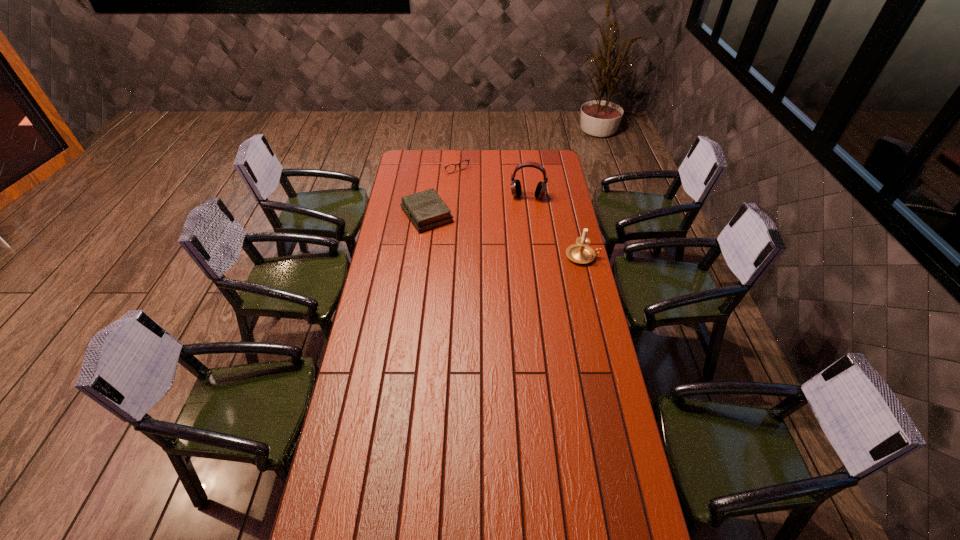
At what (x,y) coordinates should I click in order to perform the action: click on vacant space at the left edge of the desktop. Please return your answer as a coordinate pair (x, y). This screenshot has width=960, height=540. Looking at the image, I should click on click(420, 180).

At what (x,y) coordinates should I click in order to perform the action: click on free space at the right edge of the desktop. Please return your answer as a coordinate pair (x, y). The image size is (960, 540). Looking at the image, I should click on (552, 239).

Locate an element on the screen. vacant space at the far right corner of the desktop is located at coordinates (546, 150).

The width and height of the screenshot is (960, 540). I want to click on free spot between the farthest object and the candle holder, so pos(516,210).

Identify the location of unoccupied area between the candle holder and the farthest object. The image size is (960, 540). (516, 210).

Identify the location of blank region between the book and the shortest object. This screenshot has height=540, width=960. pos(439,190).

This screenshot has width=960, height=540. What are the coordinates of `vacant point located between the farthest object and the headset` in the screenshot? It's located at click(x=490, y=180).

Locate an element on the screen. vacant region between the candle holder and the book is located at coordinates (505, 235).

Find the location of `free space between the spectacles and the headset`. free space between the spectacles and the headset is located at coordinates (490, 180).

What are the coordinates of `free space between the second tallest object and the farthest object` in the screenshot? It's located at (516, 210).